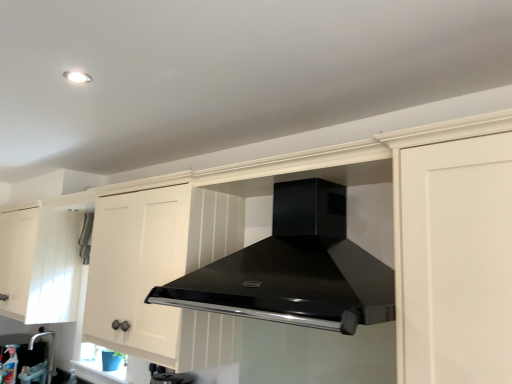
Describe the element at coordinates (295, 269) in the screenshot. This screenshot has height=384, width=512. I see `glossy black range hood at center` at that location.

Identify the location of glossy black range hood at center. The image size is (512, 384). [x=295, y=269].

The height and width of the screenshot is (384, 512). I want to click on glossy black range hood at center, so click(295, 269).